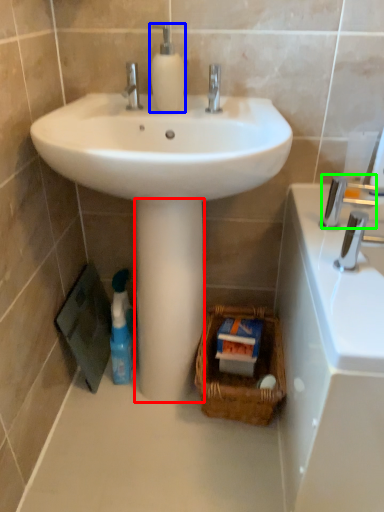
Question: Which object is positioned farthest from pillar (highlighted by a red box)? Select from soap dispenser (highlighted by a blue box) and plumbing fixture (highlighted by a green box).

Choices:
 (A) soap dispenser
 (B) plumbing fixture

Answer: (A)